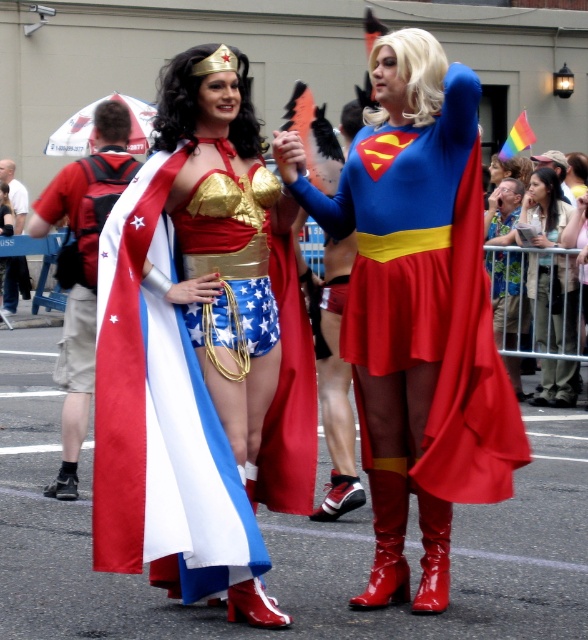
Question: Considering the relative positions of shiny blue fabric cape at center and shiny red boots at center in the image provided, where is shiny blue fabric cape at center located with respect to shiny red boots at center?

Choices:
 (A) above
 (B) below

Answer: (B)

Question: Does matte black hair at upper right have a lesser width compared to shiny red boots at center?

Choices:
 (A) no
 (B) yes

Answer: (A)

Question: Which object is closer to the camera taking this photo?

Choices:
 (A) shiny red boots at center
 (B) matte black hair at upper right
 (C) shiny blue fabric cape at center

Answer: (C)

Question: Can you confirm if shiny metallic boots at center is positioned to the right of shiny metallic boots at lower center?

Choices:
 (A) no
 (B) yes

Answer: (B)

Question: Estimate the real-world distances between objects in this image. Which object is farther from the shiny blue fabric cape at center?

Choices:
 (A) shiny red boots at center
 (B) shiny metallic boots at center
 (C) matte black hair at upper right
 (D) shiny metallic boots at lower center

Answer: (D)

Question: Which object is the farthest from the shiny metallic boots at center?

Choices:
 (A) shiny metallic boots at lower center
 (B) matte black hair at upper right
 (C) shiny red boots at center
 (D) shiny blue fabric cape at center

Answer: (A)